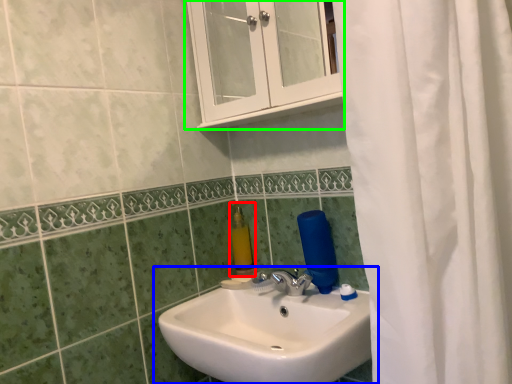
Question: Estimate the real-world distances between objects in this image. Which object is closer to soap dispenser (highlighted by a red box), sink (highlighted by a blue box) or medicine cabinet (highlighted by a green box)?

Choices:
 (A) sink
 (B) medicine cabinet

Answer: (A)